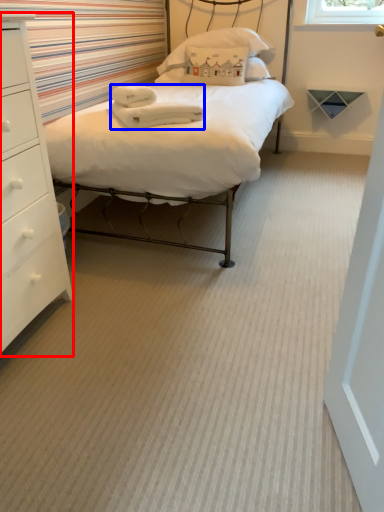
Question: Which object is further to the camera taking this photo, chest of drawers (highlighted by a red box) or material (highlighted by a blue box)?

Choices:
 (A) chest of drawers
 (B) material

Answer: (B)